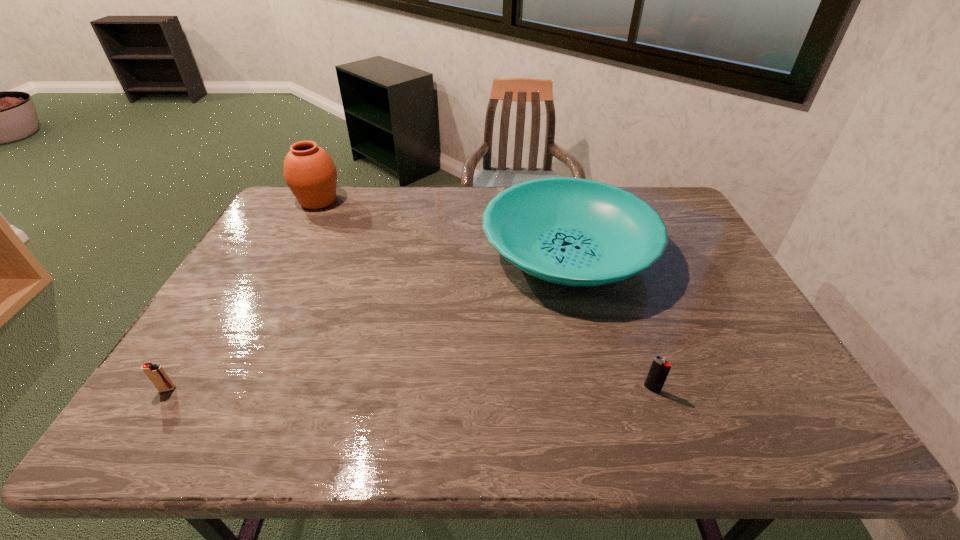
Locate an element on the screen. vacant region between the left igniter and the taller igniter is located at coordinates (410, 389).

Choose which object is the second nearest neighbor to the urn. Please provide its 2D coordinates. Your answer should be formatted as a tuple, i.e. [(x, y)], where the tuple contains the x and y coordinates of a point satisfying the conditions above.

[(157, 375)]

Locate which object is the third closest to the dish. Please provide its 2D coordinates. Your answer should be formatted as a tuple, i.e. [(x, y)], where the tuple contains the x and y coordinates of a point satisfying the conditions above.

[(157, 375)]

Where is `vacant space that satisfies the following two spatial constraints: 1. on the back side of the urn; 2. on the right side of the left igniter`? This screenshot has height=540, width=960. vacant space that satisfies the following two spatial constraints: 1. on the back side of the urn; 2. on the right side of the left igniter is located at coordinates (286, 201).

Identify the location of free point that satisfies the following two spatial constraints: 1. on the front side of the taller igniter; 2. on the left side of the urn. The width and height of the screenshot is (960, 540). (219, 389).

Locate an element on the screen. Image resolution: width=960 pixels, height=540 pixels. blank area in the image that satisfies the following two spatial constraints: 1. on the front side of the second shortest object; 2. on the left side of the dish is located at coordinates (601, 389).